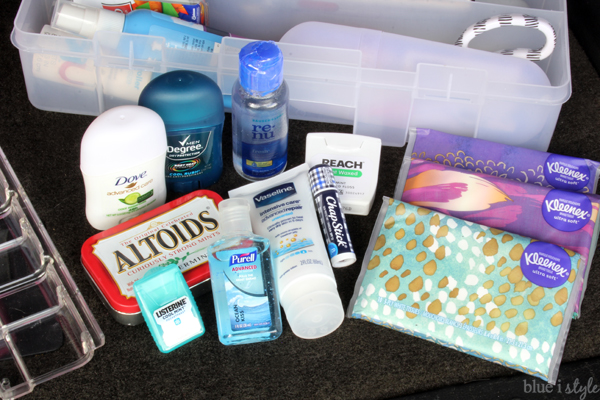
Locate an element on the screen. kleenex is located at coordinates (492, 308), (515, 223), (531, 161).